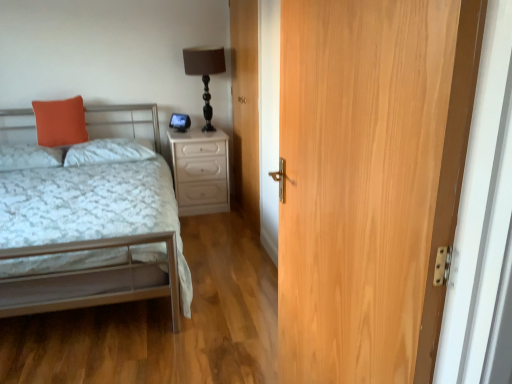
Question: Is metallic silver bed at left thinner than orange fabric pillow at left, arranged as the third pillow when viewed from the right?

Choices:
 (A) yes
 (B) no

Answer: (B)

Question: From a real-world perspective, is metallic silver bed at left positioned under orange fabric pillow at left, placed as the 1th pillow when sorted from left to right, based on gravity?

Choices:
 (A) no
 (B) yes

Answer: (B)

Question: From the image's perspective, is metallic silver bed at left over orange fabric pillow at left, arranged as the third pillow when viewed from the right?

Choices:
 (A) no
 (B) yes

Answer: (A)

Question: Is metallic silver bed at left surrounding orange fabric pillow at left, arranged as the third pillow when viewed from the right?

Choices:
 (A) no
 (B) yes

Answer: (B)

Question: Is metallic silver bed at left closer to the viewer compared to orange fabric pillow at left, placed as the 1th pillow when sorted from left to right?

Choices:
 (A) yes
 (B) no

Answer: (A)

Question: From a real-world perspective, is metallic silver bed at left over orange fabric pillow at left, arranged as the third pillow when viewed from the right?

Choices:
 (A) yes
 (B) no

Answer: (B)

Question: Considering the relative positions of metallic silver bed at left and orange matte pillow at upper left, marked as the second pillow in a left-to-right arrangement, in the image provided, is metallic silver bed at left behind orange matte pillow at upper left, marked as the second pillow in a left-to-right arrangement,?

Choices:
 (A) no
 (B) yes

Answer: (A)

Question: Is metallic silver bed at left looking in the opposite direction of orange matte pillow at upper left, arranged as the 2th pillow when viewed from the right?

Choices:
 (A) no
 (B) yes

Answer: (B)

Question: Is metallic silver bed at left oriented towards orange matte pillow at upper left, marked as the second pillow in a left-to-right arrangement?

Choices:
 (A) no
 (B) yes

Answer: (A)

Question: From the image's perspective, does metallic silver bed at left appear lower than orange matte pillow at upper left, arranged as the 2th pillow when viewed from the right?

Choices:
 (A) no
 (B) yes

Answer: (B)

Question: From the image's perspective, would you say metallic silver bed at left is positioned over orange matte pillow at upper left, arranged as the 2th pillow when viewed from the right?

Choices:
 (A) yes
 (B) no

Answer: (B)

Question: From a real-world perspective, is metallic silver bed at left positioned under orange matte pillow at upper left, marked as the second pillow in a left-to-right arrangement, based on gravity?

Choices:
 (A) yes
 (B) no

Answer: (A)

Question: Considering the relative positions of white glossy nightstand at center and metallic silver bed at left in the image provided, is white glossy nightstand at center to the right of metallic silver bed at left from the viewer's perspective?

Choices:
 (A) yes
 (B) no

Answer: (A)